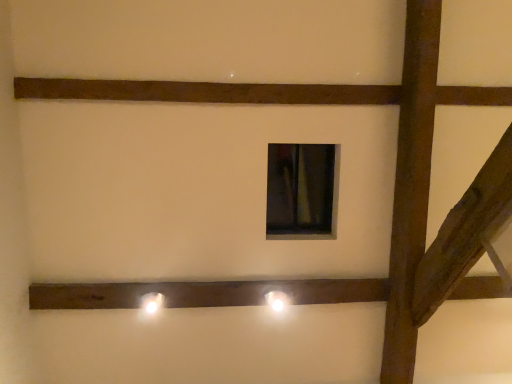
The width and height of the screenshot is (512, 384). Describe the element at coordinates (210, 92) in the screenshot. I see `dark brown wood at upper center` at that location.

Where is `dark brown wood at upper center`? dark brown wood at upper center is located at coordinates (210, 92).

Where is `dark brown wood at upper center`? The height and width of the screenshot is (384, 512). dark brown wood at upper center is located at coordinates (210, 92).